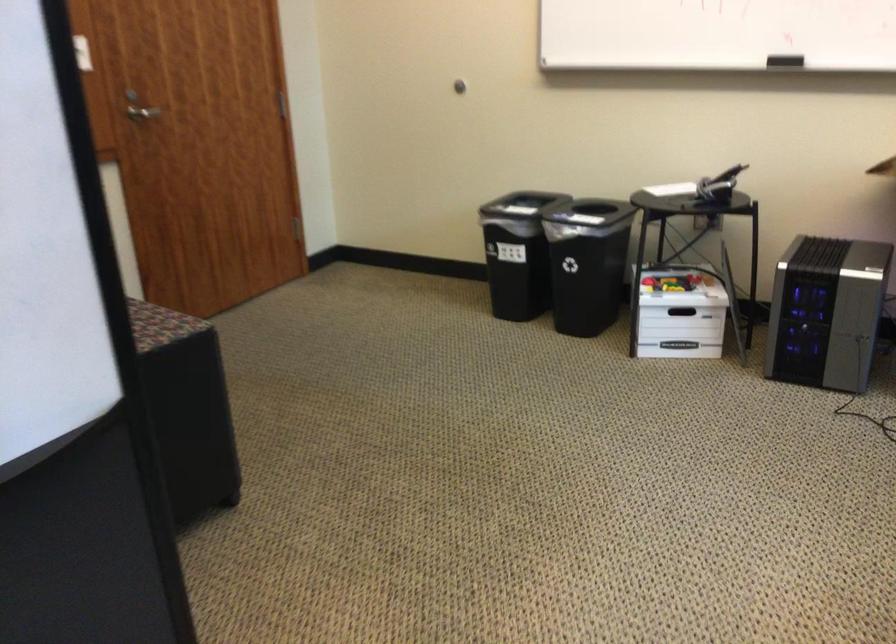
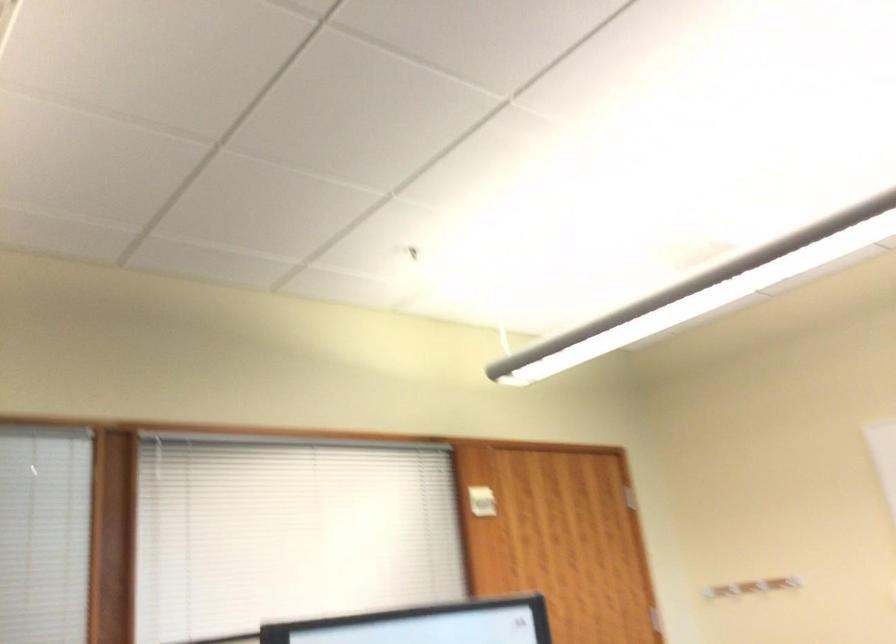
In the scene shown: How did the camera likely rotate?

The camera's rotation is toward left-up.